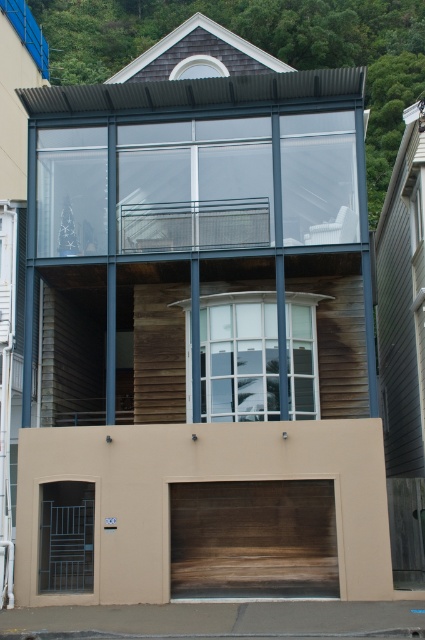
Question: Is brown wood garage door at lower center below wooden garage door at lower center?

Choices:
 (A) no
 (B) yes

Answer: (A)

Question: Which of the following is the farthest from the observer?

Choices:
 (A) brown wood garage door at lower center
 (B) wooden garage door at lower center

Answer: (A)

Question: Which object is farther from the camera taking this photo?

Choices:
 (A) wooden garage door at lower center
 (B) brown wood garage door at lower center

Answer: (B)

Question: Is brown wood garage door at lower center to the right of wooden garage door at lower center from the viewer's perspective?

Choices:
 (A) yes
 (B) no

Answer: (A)

Question: Does brown wood garage door at lower center appear on the left side of wooden garage door at lower center?

Choices:
 (A) no
 (B) yes

Answer: (A)